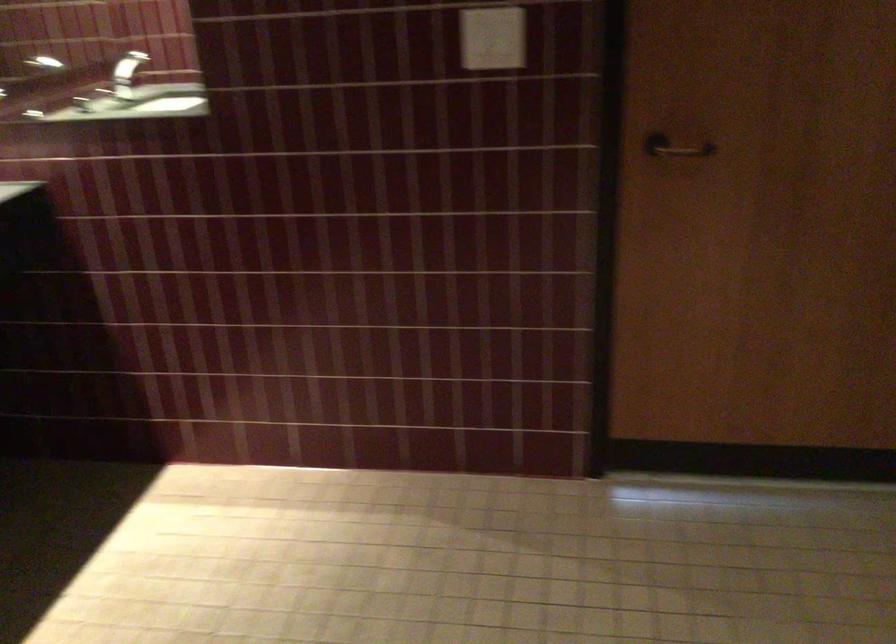
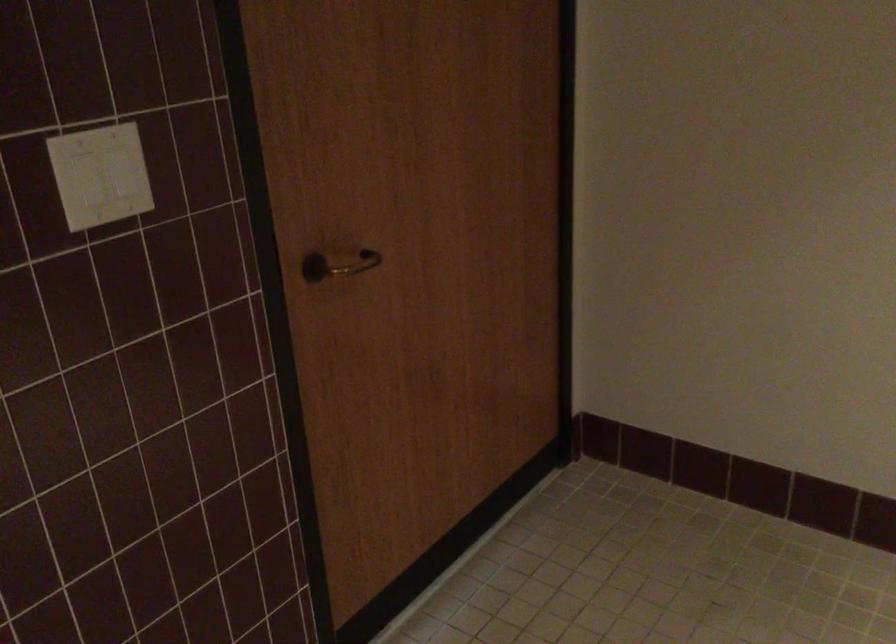
Locate, in the second image, the point that corresponds to point (678, 145) in the first image.

(338, 265)